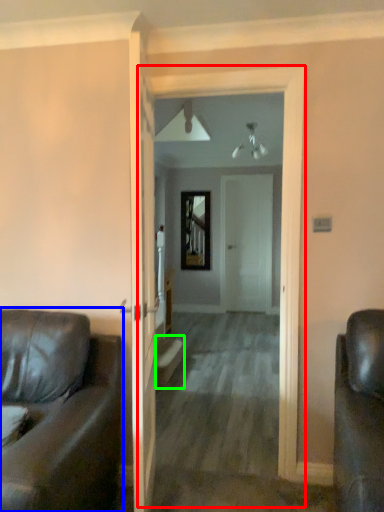
Question: Which object is the closest to the corridor (highlighted by a red box)? Choose among these: studio couch (highlighted by a blue box) or stairwell (highlighted by a green box).

Choices:
 (A) studio couch
 (B) stairwell

Answer: (A)